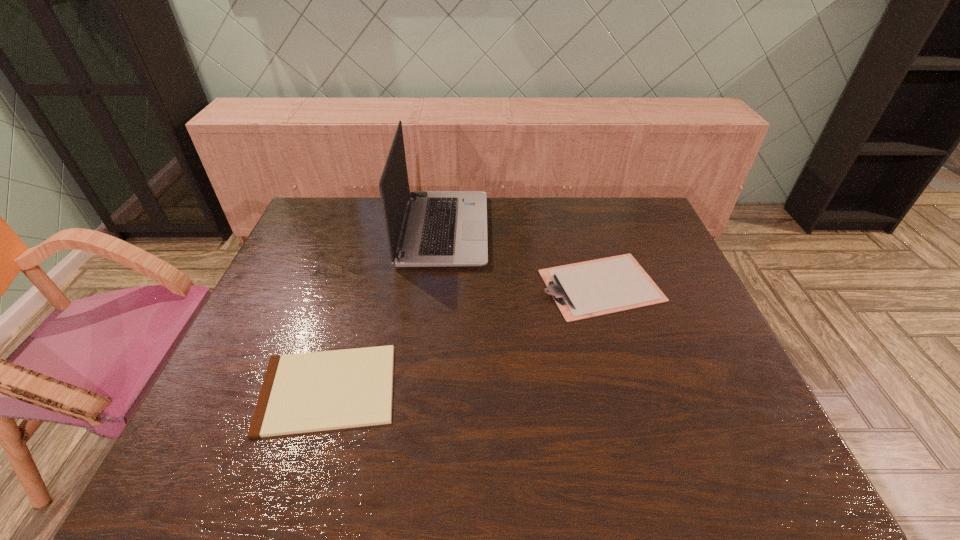
Where is `object that is the second closest to the nearest object`? object that is the second closest to the nearest object is located at coordinates (582, 290).

Select which object is the second closest to the tallest object. Please provide its 2D coordinates. Your answer should be formatted as a tuple, i.e. [(x, y)], where the tuple contains the x and y coordinates of a point satisfying the conditions above.

[(308, 392)]

Locate an element on the screen. free location that satisfies the following two spatial constraints: 1. on the screen of the right clipboard; 2. on the left side of the laptop computer is located at coordinates (438, 286).

Image resolution: width=960 pixels, height=540 pixels. I want to click on free space in the image that satisfies the following two spatial constraints: 1. on the screen of the tallest object; 2. on the left side of the rightmost object, so click(x=438, y=286).

At what (x,y) coordinates should I click in order to perform the action: click on vacant space that satisfies the following two spatial constraints: 1. on the screen of the taller clipboard; 2. on the right side of the laptop computer. Please return your answer as a coordinate pair (x, y). This screenshot has height=540, width=960. Looking at the image, I should click on (438, 286).

The width and height of the screenshot is (960, 540). Find the location of `free space that satisfies the following two spatial constraints: 1. on the back side of the nearest object; 2. on the left side of the right clipboard`. free space that satisfies the following two spatial constraints: 1. on the back side of the nearest object; 2. on the left side of the right clipboard is located at coordinates (358, 286).

In order to click on vacant space that satisfies the following two spatial constraints: 1. on the back side of the farther clipboard; 2. on the left side of the left clipboard in this screenshot , I will do `click(358, 286)`.

I want to click on vacant area that satisfies the following two spatial constraints: 1. on the screen of the laptop computer; 2. on the front side of the shortest object, so click(x=427, y=389).